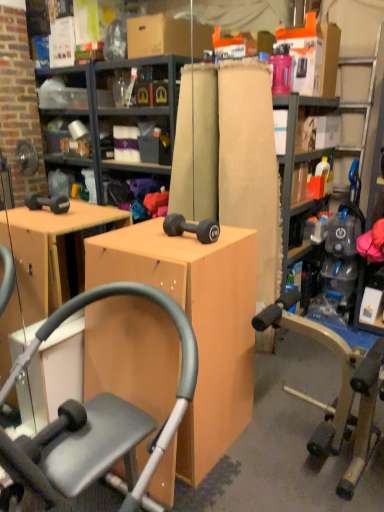
Question: From the image's perspective, would you say matte wood desk at center is positioned over matte black dumbbell at center?

Choices:
 (A) no
 (B) yes

Answer: (A)

Question: Considering the relative sizes of matte wood desk at center and matte black dumbbell at center in the image provided, is matte wood desk at center thinner than matte black dumbbell at center?

Choices:
 (A) no
 (B) yes

Answer: (A)

Question: Can you confirm if matte wood desk at center is wider than matte black dumbbell at center?

Choices:
 (A) no
 (B) yes

Answer: (B)

Question: Is there a large distance between matte wood desk at center and matte black dumbbell at center?

Choices:
 (A) no
 (B) yes

Answer: (A)

Question: Is matte wood desk at center outside matte black dumbbell at center?

Choices:
 (A) no
 (B) yes

Answer: (B)

Question: Is matte wood desk at center behind matte black dumbbell at center?

Choices:
 (A) no
 (B) yes

Answer: (A)

Question: Considering the relative sizes of wooden bookshelf at center and matte black exercise machine at center in the image provided, is wooden bookshelf at center bigger than matte black exercise machine at center?

Choices:
 (A) yes
 (B) no

Answer: (B)

Question: From the image's perspective, is wooden bookshelf at center above matte black exercise machine at center?

Choices:
 (A) no
 (B) yes

Answer: (B)

Question: Is wooden bookshelf at center positioned behind matte black exercise machine at center?

Choices:
 (A) yes
 (B) no

Answer: (A)

Question: Considering the relative positions of wooden bookshelf at center and matte black exercise machine at center in the image provided, is wooden bookshelf at center to the left of matte black exercise machine at center from the viewer's perspective?

Choices:
 (A) no
 (B) yes

Answer: (A)

Question: Is wooden bookshelf at center oriented towards matte black exercise machine at center?

Choices:
 (A) yes
 (B) no

Answer: (B)

Question: Can you confirm if wooden bookshelf at center is wider than matte black exercise machine at center?

Choices:
 (A) no
 (B) yes

Answer: (A)

Question: Is wooden bookshelf at center positioned before matte wood desk at center?

Choices:
 (A) no
 (B) yes

Answer: (A)